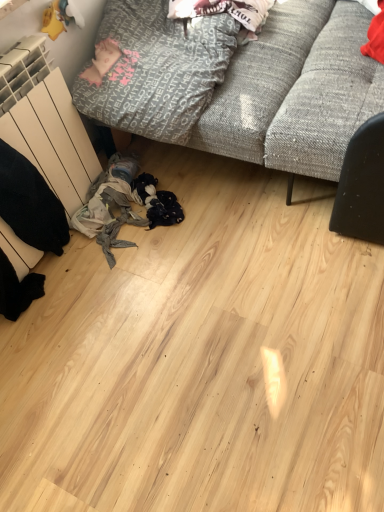
Question: Considering the relative sizes of textured gray couch at upper center and textured gray blanket at upper left, which appears as the 2th clothing when viewed from the top, in the image provided, is textured gray couch at upper center smaller than textured gray blanket at upper left, which appears as the 2th clothing when viewed from the top,?

Choices:
 (A) yes
 (B) no

Answer: (B)

Question: Can you confirm if textured gray couch at upper center is positioned to the left of textured gray blanket at upper left, which appears as the 2th clothing when viewed from the top?

Choices:
 (A) yes
 (B) no

Answer: (B)

Question: Is textured gray couch at upper center surrounding textured gray blanket at upper left, which appears as the first clothing when ordered from the bottom?

Choices:
 (A) no
 (B) yes

Answer: (B)

Question: From the image's perspective, is textured gray couch at upper center above textured gray blanket at upper left, which appears as the first clothing when ordered from the bottom?

Choices:
 (A) no
 (B) yes

Answer: (B)

Question: Does textured gray couch at upper center come in front of textured gray blanket at upper left, which appears as the first clothing when ordered from the bottom?

Choices:
 (A) yes
 (B) no

Answer: (A)

Question: Is white cotton t-shirt at upper center, the first clothing positioned from the top, wider or thinner than textured gray couch at upper center?

Choices:
 (A) wide
 (B) thin

Answer: (B)

Question: Based on their sizes in the image, would you say white cotton t-shirt at upper center, which appears as the second clothing when ordered from the bottom, is bigger or smaller than textured gray couch at upper center?

Choices:
 (A) small
 (B) big

Answer: (A)

Question: In the image, is white cotton t-shirt at upper center, the first clothing positioned from the top, on the left side or the right side of textured gray couch at upper center?

Choices:
 (A) right
 (B) left

Answer: (B)

Question: Is white cotton t-shirt at upper center, the first clothing positioned from the top, in front of or behind textured gray couch at upper center in the image?

Choices:
 (A) behind
 (B) front

Answer: (A)

Question: Considering the positions of white cotton t-shirt at upper center, the first clothing positioned from the top, and textured gray blanket at upper left, which appears as the 2th clothing when viewed from the top, in the image, is white cotton t-shirt at upper center, the first clothing positioned from the top, wider or thinner than textured gray blanket at upper left, which appears as the 2th clothing when viewed from the top,?

Choices:
 (A) thin
 (B) wide

Answer: (A)

Question: In terms of size, does white cotton t-shirt at upper center, which appears as the second clothing when ordered from the bottom, appear bigger or smaller than textured gray blanket at upper left, which appears as the 2th clothing when viewed from the top?

Choices:
 (A) small
 (B) big

Answer: (A)

Question: Is white cotton t-shirt at upper center, the first clothing positioned from the top, inside the boundaries of textured gray blanket at upper left, which appears as the 2th clothing when viewed from the top, or outside?

Choices:
 (A) inside
 (B) outside

Answer: (A)

Question: From the image's perspective, relative to textured gray blanket at upper left, which appears as the first clothing when ordered from the bottom, is white cotton t-shirt at upper center, which appears as the second clothing when ordered from the bottom, above or below?

Choices:
 (A) below
 (B) above

Answer: (B)

Question: Considering the positions of textured gray couch at upper center and white cotton t-shirt at upper center, which appears as the second clothing when ordered from the bottom, in the image, is textured gray couch at upper center bigger or smaller than white cotton t-shirt at upper center, which appears as the second clothing when ordered from the bottom,?

Choices:
 (A) small
 (B) big

Answer: (B)

Question: Is point (192, 142) closer or farther from the camera than point (198, 4)?

Choices:
 (A) farther
 (B) closer

Answer: (B)